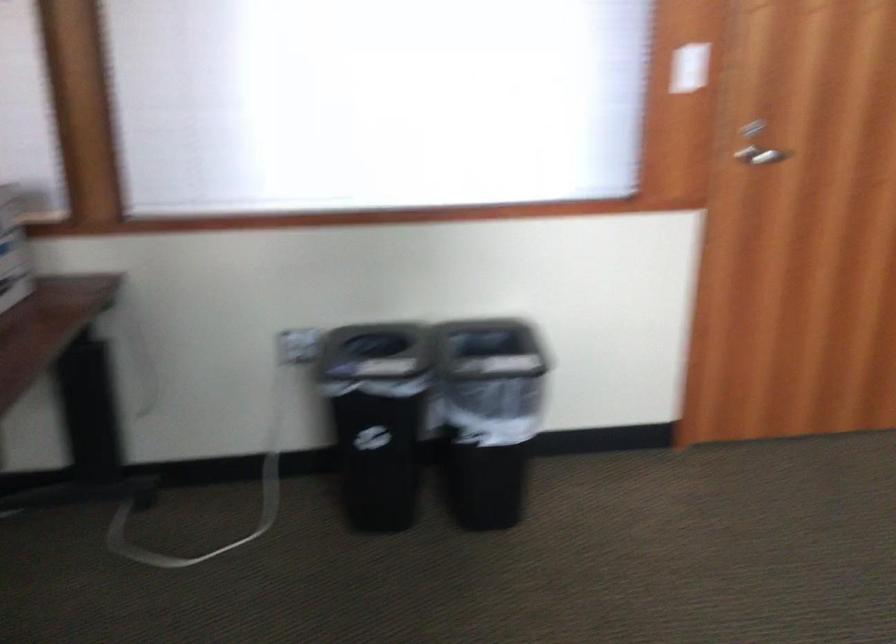
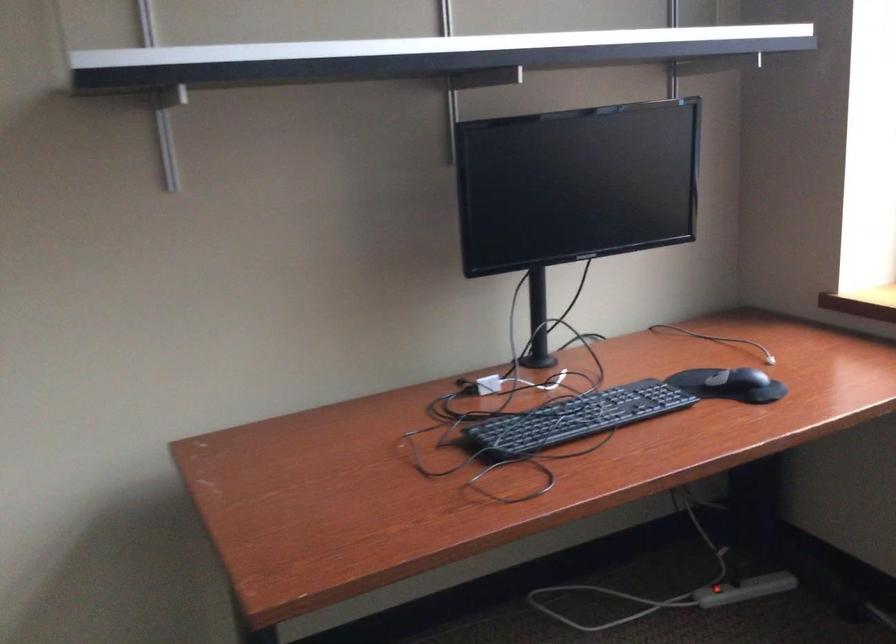
Based on the continuous images, in which direction is the camera rotating?

The rotation direction of the camera is right-down.